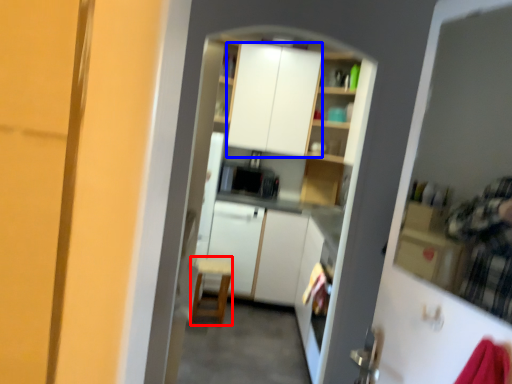
Question: Among these objects, which one is nearest to the camera, chair (highlighted by a red box) or cabinetry (highlighted by a blue box)?

Choices:
 (A) chair
 (B) cabinetry

Answer: (A)